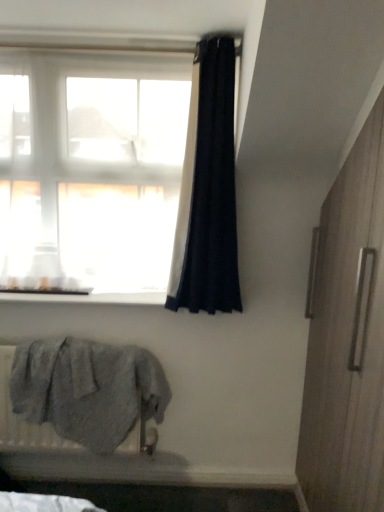
Find the location of a particular element. This screenshot has width=384, height=512. vacant space situated above black fabric curtain at upper center (from a real-world perspective) is located at coordinates (223, 25).